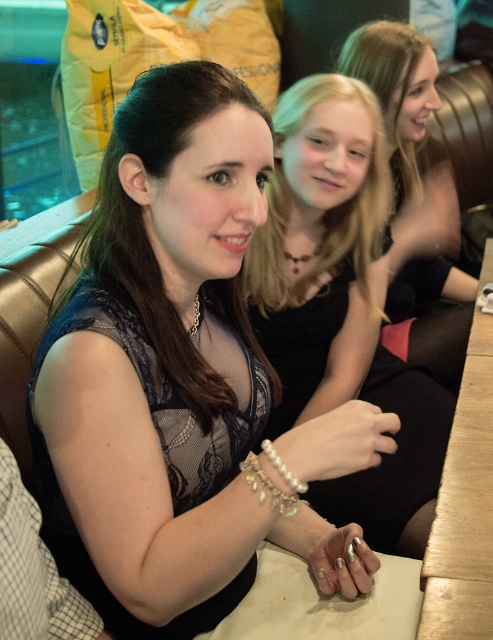
Is matte black dress at center positioned behind smooth black dress at center?

No, it is not.

Between matte black dress at center and smooth black dress at center, which one has more height?

smooth black dress at center is taller.

This screenshot has height=640, width=493. Describe the element at coordinates (143, 225) in the screenshot. I see `matte black dress at center` at that location.

Identify the location of matte black dress at center. Image resolution: width=493 pixels, height=640 pixels. (143, 225).

Does lace fabric dress at center have a greater height compared to pearl-like beaded bracelet at center?

Yes.

Measure the distance between lace fabric dress at center and pearl-like beaded bracelet at center.

lace fabric dress at center is 26.34 centimeters from pearl-like beaded bracelet at center.

Which is behind, point (249, 369) or point (270, 442)?

Positioned behind is point (249, 369).

The image size is (493, 640). What are the coordinates of `lace fabric dress at center` in the screenshot? It's located at (169, 372).

Does matte black dress at center have a smaller size compared to pearl-like beaded bracelet at center?

No.

Can you confirm if matte black dress at center is thinner than pearl-like beaded bracelet at center?

Incorrect, matte black dress at center's width is not less than pearl-like beaded bracelet at center's.

Which is behind, point (239, 104) or point (291, 474)?

The point (239, 104) is more distant.

The height and width of the screenshot is (640, 493). Find the location of `matte black dress at center`. matte black dress at center is located at coordinates (143, 225).